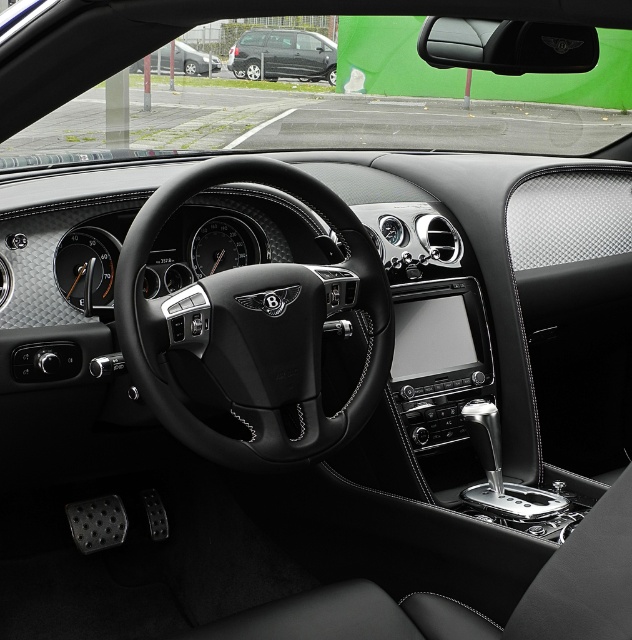
Question: From the image, what is the correct spatial relationship of matte black van at center in relation to matte black car at upper left?

Choices:
 (A) above
 (B) below

Answer: (A)

Question: Which of the following is the closest to the observer?

Choices:
 (A) matte black van at center
 (B) matte black car at upper left
 (C) black leather steering wheel at center

Answer: (C)

Question: Does matte black van at center appear on the left side of matte black car at upper left?

Choices:
 (A) no
 (B) yes

Answer: (A)

Question: Which object is positioned farthest from the black leather steering wheel at center?

Choices:
 (A) matte black car at upper left
 (B) matte black van at center

Answer: (A)

Question: Which point is farther from the camera taking this photo?

Choices:
 (A) pyautogui.click(x=289, y=364)
 (B) pyautogui.click(x=154, y=51)

Answer: (A)

Question: Can you confirm if black leather steering wheel at center is thinner than matte black van at center?

Choices:
 (A) no
 (B) yes

Answer: (B)